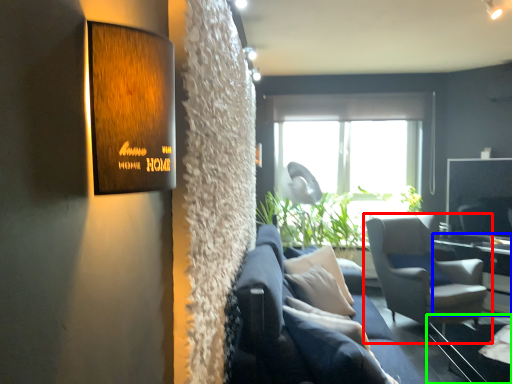
Question: Which object is the farthest from chair (highlighted by a red box)? Choose among these: table (highlighted by a blue box) or glass table (highlighted by a green box).

Choices:
 (A) table
 (B) glass table

Answer: (A)